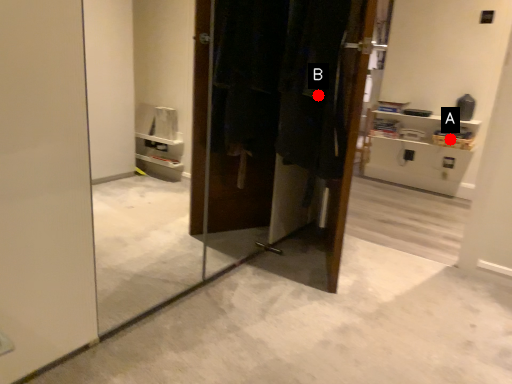
Question: Two points are circled on the image, labeled by A and B beside each circle. Which point is closer to the camera?

Choices:
 (A) A is closer
 (B) B is closer

Answer: (B)